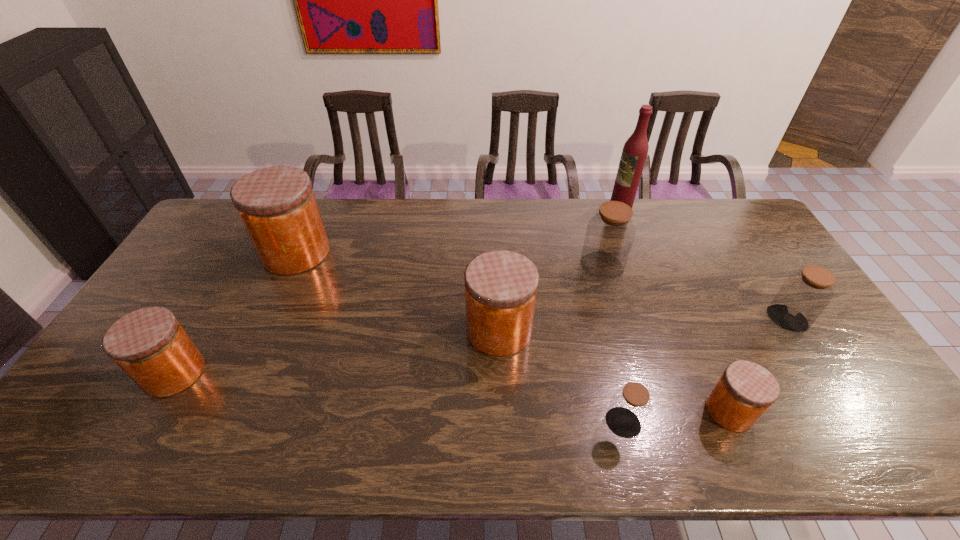
At what (x,y) coordinates should I click in order to perform the action: click on blank space at the right edge of the desktop. Please return your answer as a coordinate pair (x, y). The image size is (960, 540). Looking at the image, I should click on (865, 422).

Where is `vacant region at the far left corner of the desktop`? The image size is (960, 540). vacant region at the far left corner of the desktop is located at coordinates (198, 233).

You are a GUI agent. You are given a task and a screenshot of the screen. Output one action in this format:
    pyautogui.click(x=<x>, y=<y>)
    Task: Click on the free space at the far right corner
    The image size is (960, 540).
    Given the screenshot: What is the action you would take?
    pyautogui.click(x=716, y=198)

At what (x,y) coordinates should I click in order to perform the action: click on empty location between the third jar from left to right and the rightmost object. Please return your answer as a coordinate pair (x, y). The width and height of the screenshot is (960, 540). Looking at the image, I should click on (643, 325).

This screenshot has height=540, width=960. Identify the location of free spot between the smallest brown jar and the rightmost orange jar. point(676,417).

Where is `vacant space in between the rightmost object and the biggest orange jar`? The height and width of the screenshot is (540, 960). vacant space in between the rightmost object and the biggest orange jar is located at coordinates (541, 286).

Locate an element on the screen. The width and height of the screenshot is (960, 540). free space between the rightmost brown jar and the nearest brown jar is located at coordinates (705, 371).

I want to click on vacant space in between the second biggest brown jar and the farthest object, so click(x=703, y=265).

Where is `vacant space that's between the rightmost orange jar and the second smallest orange jar`? The image size is (960, 540). vacant space that's between the rightmost orange jar and the second smallest orange jar is located at coordinates (452, 392).

The image size is (960, 540). What are the coordinates of `vacant area between the farthest object and the tallest jar` in the screenshot? It's located at (458, 232).